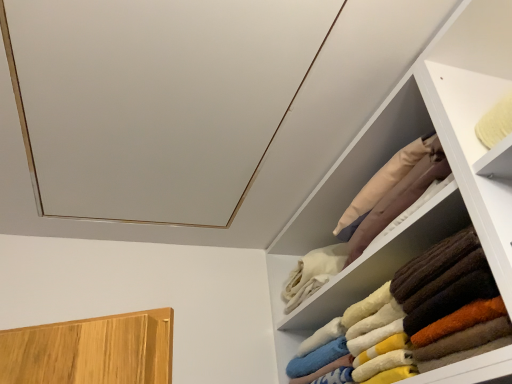
Describe the element at coordinates (414, 316) in the screenshot. I see `fluffy fleece socks at lower right` at that location.

What is the approximate width of fluffy fleece socks at lower right?

11.41 inches.

This screenshot has height=384, width=512. Find the location of `fluffy fleece socks at lower right`. fluffy fleece socks at lower right is located at coordinates (414, 316).

In order to face fluffy fleece socks at lower right, should I rotate leftwards or rightwards?

You should look right and rotate roughly 19.736 degrees.

Find the location of a particular element. This screenshot has width=512, height=384. fluffy fleece socks at lower right is located at coordinates tap(414, 316).